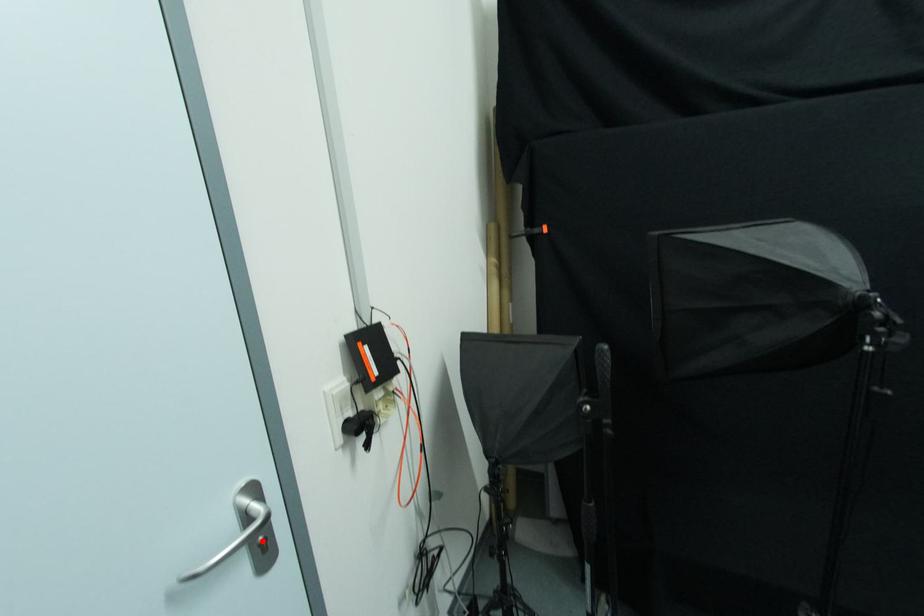
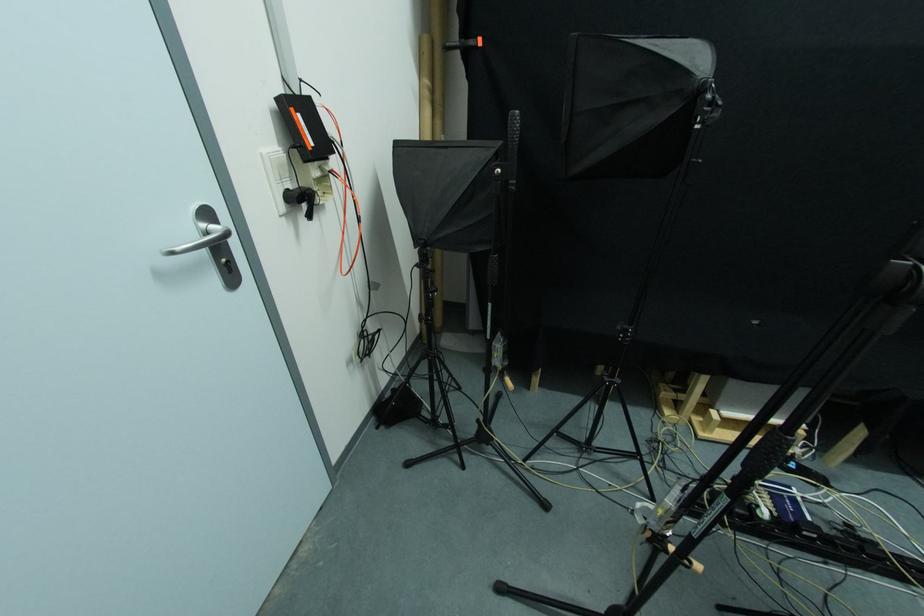
Where in the second image is the point corresponding to the highlighted location from the first image?

(226, 262)